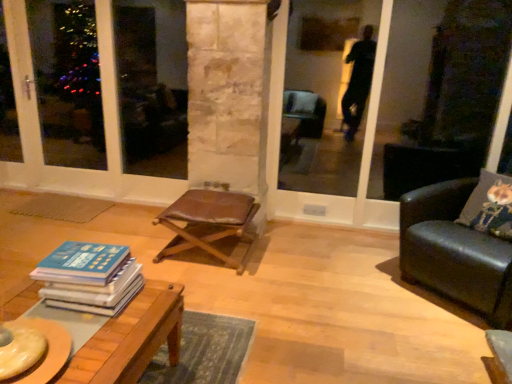
Locate an element on the screen. This screenshot has width=512, height=384. blank space situated above leather stool at center (from a real-world perspective) is located at coordinates (209, 200).